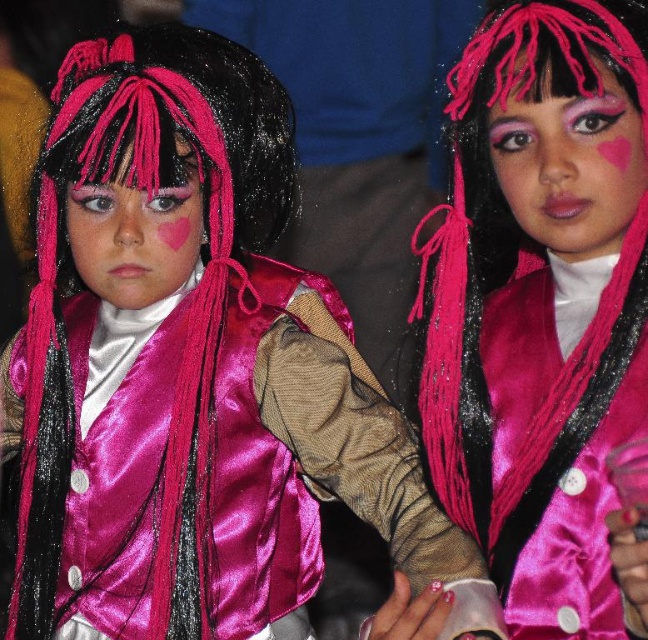
You are standing 5 feet away from a point marked at coordinates point (583, 106). If you take a step forward of 1.25 feet, will you be closer than 3 feet to that point?

Result: The distance of point (583, 106) from viewer is 3.75 feet. After stepping forward 1.25 feet, you are now 3.75 minus 1.25 equals 2.5 feet away. Since 2.5 is less than 3, yes, you will be closer than 3 feet to that point.

You are a photographer setting up for a photoshoot. You see two models with pink matte wigs in the frame. One is the pink matte wig at center and the other is the matte pink wig at left. Which wig is positioned to the right side of the other?

The pink matte wig at center is positioned to the right of the matte pink wig at left.